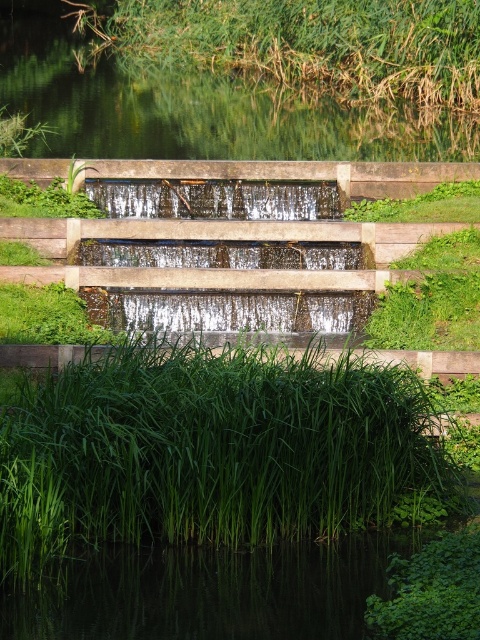
Question: Which point is closer to the camera?

Choices:
 (A) (345, 92)
 (B) (223, 515)

Answer: (B)

Question: In this image, where is green leafy grass at lower center located relative to green grass at upper left?

Choices:
 (A) left
 (B) right

Answer: (B)

Question: Is green leafy grass at lower center bigger than green grass at upper left?

Choices:
 (A) yes
 (B) no

Answer: (B)

Question: In this image, where is green leafy grass at lower center located relative to green grass at upper left?

Choices:
 (A) right
 (B) left

Answer: (A)

Question: Among these objects, which one is nearest to the camera?

Choices:
 (A) green grass at upper left
 (B) green leafy grass at lower center

Answer: (B)